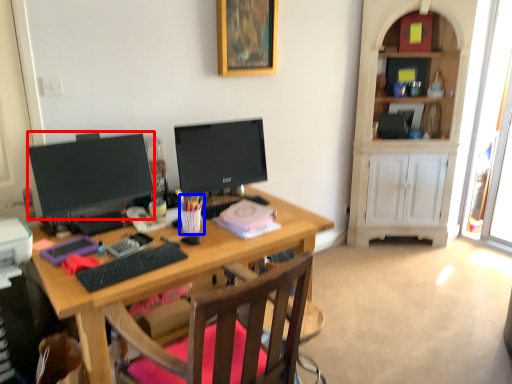
Question: Which point is further to the camera, television (highlighted by a red box) or stationery (highlighted by a blue box)?

Choices:
 (A) television
 (B) stationery

Answer: (B)